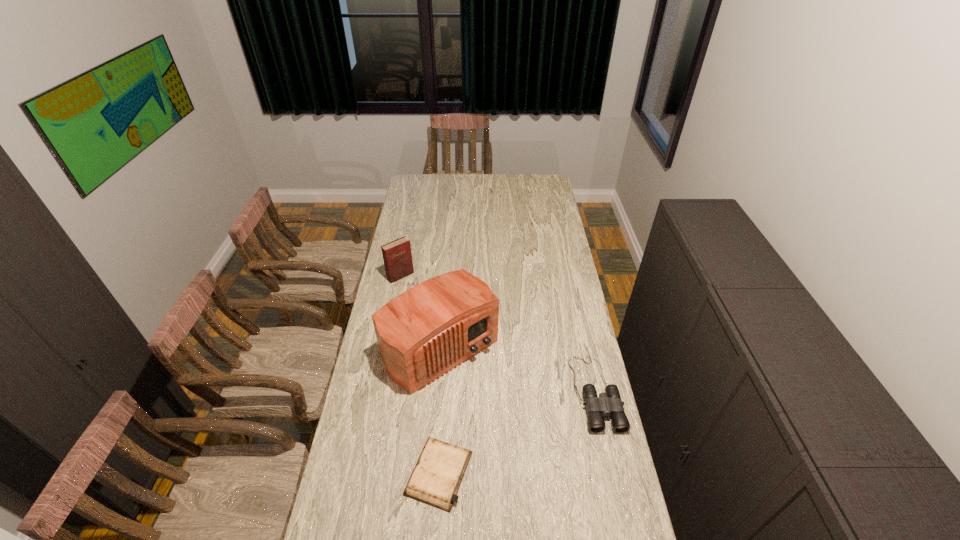
Locate an element on the screen. This screenshot has width=960, height=540. vacant space located on the front-facing side of the tallest object is located at coordinates (539, 453).

This screenshot has height=540, width=960. I want to click on vacant space located on the front-facing side of the tallest object, so (x=498, y=409).

I want to click on vacant area situated on the front cover of the farther diary, so click(x=452, y=329).

This screenshot has width=960, height=540. I want to click on free space located 0.140m on the front cover of the farther diary, so click(x=423, y=299).

Identify the location of free space located on the front cover of the farther diary. Image resolution: width=960 pixels, height=540 pixels. (435, 312).

The height and width of the screenshot is (540, 960). I want to click on object located at the near edge, so click(x=435, y=480).

Find the location of `radio receiver that is positioned at the left edge`. radio receiver that is positioned at the left edge is located at coordinates (431, 328).

Locate an element on the screen. Image resolution: width=960 pixels, height=540 pixels. diary located at the left edge is located at coordinates (397, 256).

Identify the location of object that is at the right edge. (609, 403).

Find the location of a particular element. This screenshot has height=540, width=960. vacant space at the far edge is located at coordinates (460, 187).